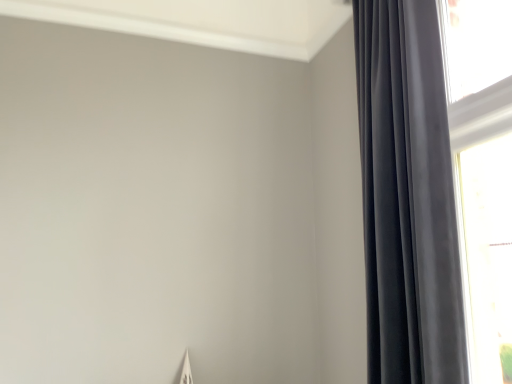
What are the coordinates of `transparent glass window at right` in the screenshot? It's located at (482, 173).

Image resolution: width=512 pixels, height=384 pixels. Describe the element at coordinates (482, 173) in the screenshot. I see `transparent glass window at right` at that location.

Locate an element on the screen. satin black curtain at right is located at coordinates (407, 197).

This screenshot has width=512, height=384. What do you see at coordinates (407, 197) in the screenshot? I see `satin black curtain at right` at bounding box center [407, 197].

Where is `transparent glass window at right`? This screenshot has height=384, width=512. transparent glass window at right is located at coordinates (482, 173).

In the image, is satin black curtain at right on the left side or the right side of transparent glass window at right?

Clearly, satin black curtain at right is on the left of transparent glass window at right in the image.

Considering their positions, is satin black curtain at right located in front of or behind transparent glass window at right?

satin black curtain at right is positioned closer to the viewer than transparent glass window at right.

Considering the positions of point (448, 198) and point (503, 4), is point (448, 198) closer or farther from the camera than point (503, 4)?

Point (448, 198).

From the image's perspective, is satin black curtain at right over transparent glass window at right?

Yes, from the image's perspective, satin black curtain at right is above transparent glass window at right.

From a real-world perspective, is satin black curtain at right physically below transparent glass window at right?

No, from a real-world perspective, satin black curtain at right is not beneath transparent glass window at right.

Between satin black curtain at right and transparent glass window at right, which one has smaller width?

With smaller width is transparent glass window at right.

Who is shorter, satin black curtain at right or transparent glass window at right?

With less height is transparent glass window at right.

Considering the relative sizes of satin black curtain at right and transparent glass window at right in the image provided, is satin black curtain at right smaller than transparent glass window at right?

No, satin black curtain at right is not smaller than transparent glass window at right.

Is satin black curtain at right completely or partially outside of transparent glass window at right?

Yes, satin black curtain at right is located beyond the bounds of transparent glass window at right.

Would you consider satin black curtain at right to be distant from transparent glass window at right?

No, satin black curtain at right is not far away from transparent glass window at right.

Is satin black curtain at right facing away from transparent glass window at right?

Absolutely, satin black curtain at right is directed away from transparent glass window at right.

Find the location of a particular element. This screenshot has height=384, width=512. window that appears below the satin black curtain at right (from the image's perspective) is located at coordinates (482, 173).

Is transparent glass window at right at the left side of satin black curtain at right?

In fact, transparent glass window at right is to the right of satin black curtain at right.

Does transparent glass window at right lie behind satin black curtain at right?

Yes, it is.

Which is closer, (442, 17) or (388, 172)?

Point (442, 17) appears to be farther away from the viewer than point (388, 172).

From the image's perspective, is transparent glass window at right beneath satin black curtain at right?

Correct, transparent glass window at right appears lower than satin black curtain at right in the image.

From a real-world perspective, is transparent glass window at right physically located above or below satin black curtain at right?

From a real-world perspective, transparent glass window at right is physically below satin black curtain at right.

In terms of width, does transparent glass window at right look wider or thinner when compared to satin black curtain at right?

Considering their sizes, transparent glass window at right looks slimmer than satin black curtain at right.

Who is taller, transparent glass window at right or satin black curtain at right?

Standing taller between the two is satin black curtain at right.

In terms of size, does transparent glass window at right appear bigger or smaller than satin black curtain at right?

transparent glass window at right is smaller than satin black curtain at right.

Is transparent glass window at right inside the boundaries of satin black curtain at right, or outside?

transparent glass window at right is not enclosed by satin black curtain at right.

Are transparent glass window at right and satin black curtain at right making contact?

No, transparent glass window at right is not making contact with satin black curtain at right.

Is transparent glass window at right aimed at satin black curtain at right?

Yes, transparent glass window at right is aimed at satin black curtain at right.

Measure the distance from transparent glass window at right to satin black curtain at right.

They are 32.33 centimeters apart.

Where is `window below the satin black curtain at right (from the image's perspective)`? Image resolution: width=512 pixels, height=384 pixels. window below the satin black curtain at right (from the image's perspective) is located at coordinates (482, 173).

Locate an element on the screen. The height and width of the screenshot is (384, 512). curtain in front of the transparent glass window at right is located at coordinates (407, 197).

There is a transparent glass window at right. Identify the location of curtain above it (from a real-world perspective). The height and width of the screenshot is (384, 512). (407, 197).